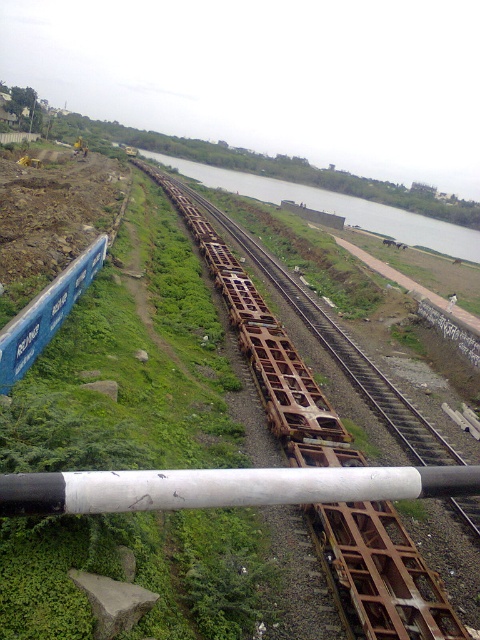
Question: Which point is farther from the camera taking this photo?

Choices:
 (A) (51, 333)
 (B) (108, 509)

Answer: (A)

Question: Can you confirm if white matte pole at center is positioned to the right of green grassy river at center?

Choices:
 (A) no
 (B) yes

Answer: (A)

Question: Considering the relative positions of white matte pole at center and green grassy river at center in the image provided, where is white matte pole at center located with respect to green grassy river at center?

Choices:
 (A) left
 (B) right

Answer: (A)

Question: Based on their relative distances, which object is farther from the white matte pole at center?

Choices:
 (A) green grassy river at center
 (B) blue matte freight car at left

Answer: (A)

Question: Is green grassy river at center to the left of blue matte freight car at left from the viewer's perspective?

Choices:
 (A) no
 (B) yes

Answer: (A)

Question: Which of the following is the farthest from the observer?

Choices:
 (A) (327, 483)
 (B) (372, 227)

Answer: (B)